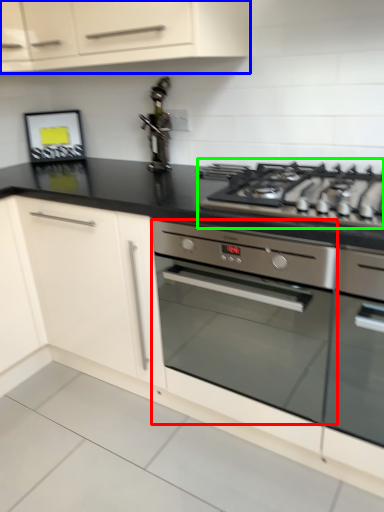
Question: Considering the real-world distances, which object is farthest from home appliance (highlighted by a red box)? cabinetry (highlighted by a blue box) or gas stove (highlighted by a green box)?

Choices:
 (A) cabinetry
 (B) gas stove

Answer: (A)